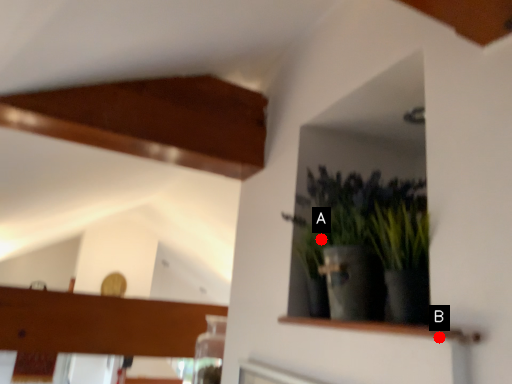
Question: Two points are circled on the image, labeled by A and B beside each circle. Which point is further to the camera?

Choices:
 (A) A is further
 (B) B is further

Answer: (A)